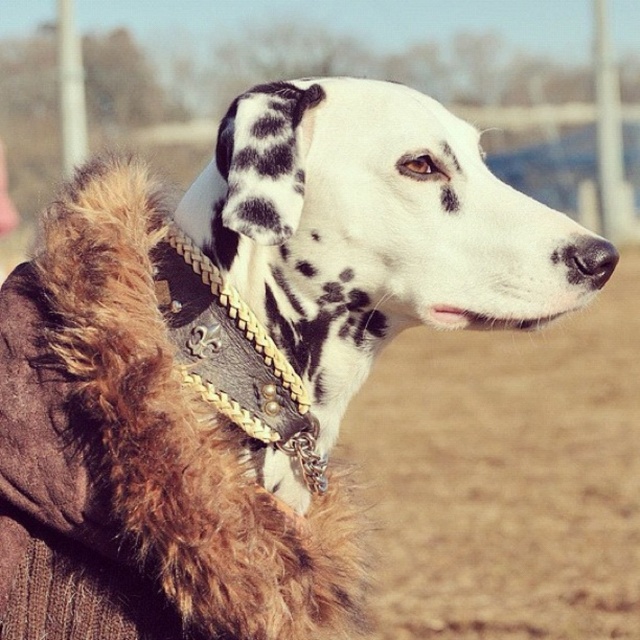
Who is more distant from viewer, (531, 428) or (310, 428)?

The point (531, 428) is behind.

Based on the photo, does brown dirt field at lower right have a lesser width compared to leather/golden chain neckband at upper center?

No.

Who is more distant from viewer, (396, 403) or (168, 250)?

Positioned behind is point (396, 403).

At what (x,y) coordinates should I click in order to perform the action: click on brown dirt field at lower right. Please return your answer as a coordinate pair (x, y). Looking at the image, I should click on (508, 476).